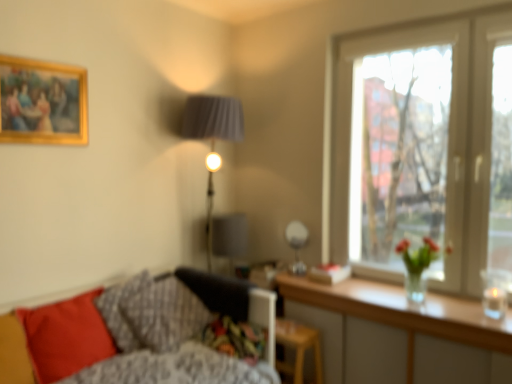
Question: Can you confirm if gold-framed painting at upper left is wider than transparent glass window at upper right?

Choices:
 (A) yes
 (B) no

Answer: (B)

Question: Is gold-framed painting at upper left at the right side of transparent glass window at upper right?

Choices:
 (A) yes
 (B) no

Answer: (B)

Question: Considering the relative sizes of gold-framed painting at upper left and transparent glass window at upper right in the image provided, is gold-framed painting at upper left smaller than transparent glass window at upper right?

Choices:
 (A) yes
 (B) no

Answer: (A)

Question: Is gold-framed painting at upper left closer to camera compared to transparent glass window at upper right?

Choices:
 (A) no
 (B) yes

Answer: (B)

Question: From a real-world perspective, is gold-framed painting at upper left over transparent glass window at upper right?

Choices:
 (A) no
 (B) yes

Answer: (B)

Question: Does gold-framed painting at upper left turn towards transparent glass window at upper right?

Choices:
 (A) yes
 (B) no

Answer: (B)

Question: From a real-world perspective, is textured gray pillow at lower left, which ranks as the second pillow in right-to-left order, on wooden stool at lower center?

Choices:
 (A) yes
 (B) no

Answer: (A)

Question: Considering the relative sizes of textured gray pillow at lower left, which ranks as the second pillow in right-to-left order, and wooden stool at lower center in the image provided, is textured gray pillow at lower left, which ranks as the second pillow in right-to-left order, thinner than wooden stool at lower center?

Choices:
 (A) no
 (B) yes

Answer: (A)

Question: Is textured gray pillow at lower left, which ranks as the second pillow in right-to-left order, not near wooden stool at lower center?

Choices:
 (A) yes
 (B) no

Answer: (B)

Question: From the image's perspective, does textured gray pillow at lower left, the 2th pillow when ordered from left to right, appear lower than wooden stool at lower center?

Choices:
 (A) yes
 (B) no

Answer: (B)

Question: Is textured gray pillow at lower left, the 2th pillow when ordered from left to right, closer to the viewer compared to wooden stool at lower center?

Choices:
 (A) no
 (B) yes

Answer: (B)

Question: Considering the relative positions of textured gray pillow at lower left, which ranks as the second pillow in right-to-left order, and wooden stool at lower center in the image provided, is textured gray pillow at lower left, which ranks as the second pillow in right-to-left order, behind wooden stool at lower center?

Choices:
 (A) no
 (B) yes

Answer: (A)

Question: Is gold-framed painting at upper left shorter than fluffy gray pillow at lower left, the first pillow positioned from the right?

Choices:
 (A) yes
 (B) no

Answer: (B)